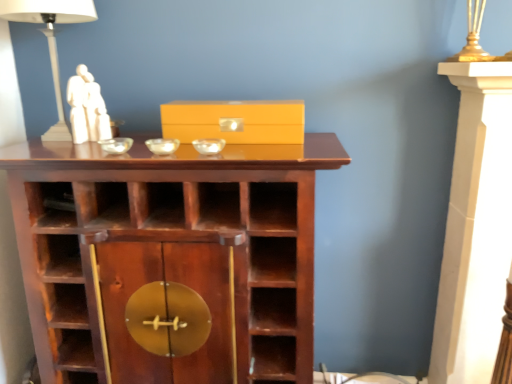
The height and width of the screenshot is (384, 512). In order to click on empty space that is in between transparent glass bowl at center, positioned as the first glass bowl in right-to-left order, and matte yellow box at center in this screenshot , I will do `click(230, 141)`.